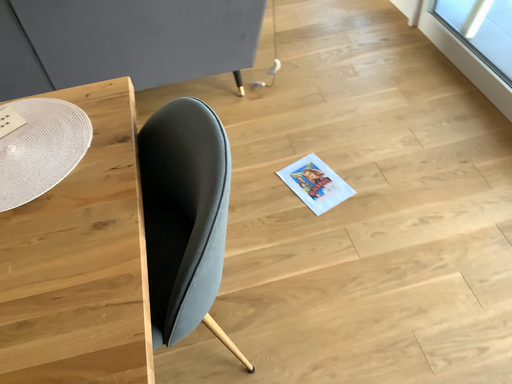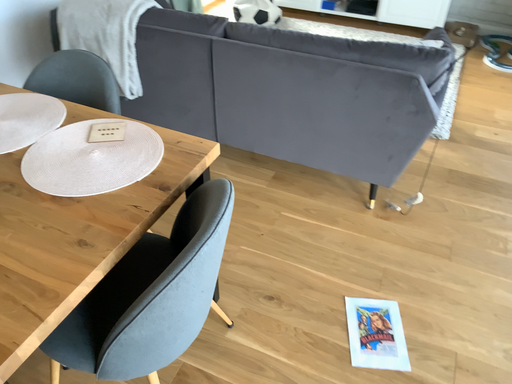
Question: How did the camera likely rotate when shooting the video?

Choices:
 (A) rotated upward
 (B) rotated downward

Answer: (A)